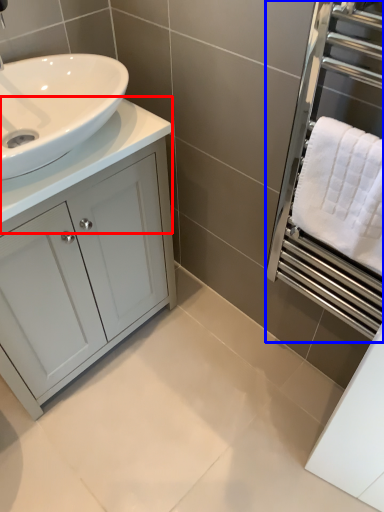
Question: Which of the following is the farthest to the observer, counter top (highlighted by a red box) or screen door (highlighted by a blue box)?

Choices:
 (A) counter top
 (B) screen door

Answer: (A)